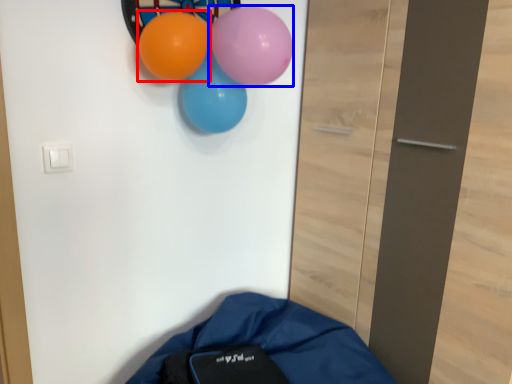
Question: Which point is further to the camera, balloon (highlighted by a red box) or balloon (highlighted by a blue box)?

Choices:
 (A) balloon
 (B) balloon

Answer: (A)